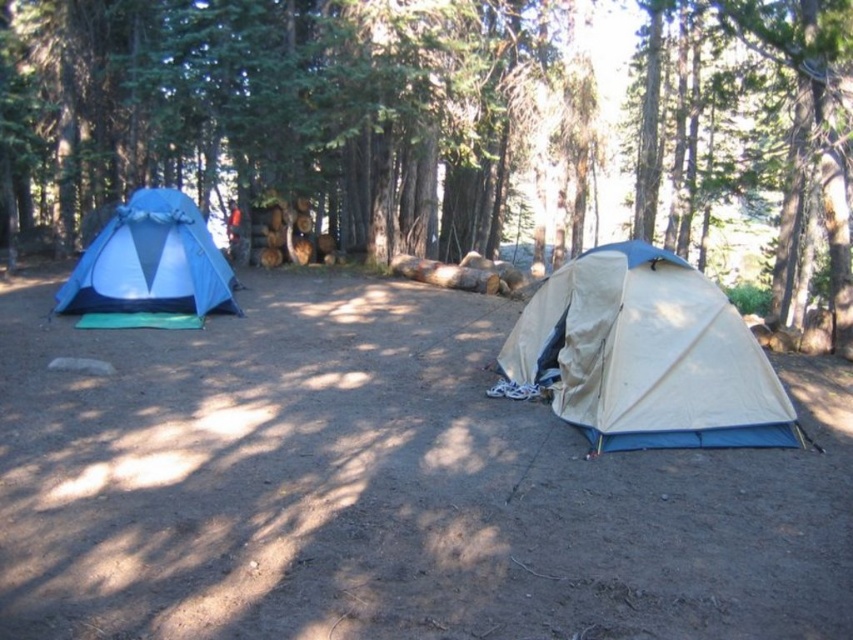
You are a hiker who wants to set up a new tent in this camping area. You have a map showing a specific coordinate point. Which tent is located at the coordinate point (303, 120)?

The point at coordinate (303, 120) indicates the green matte tent at left.

You are standing at the center of the image and want to find the green matte tent at left. Based on its 2D coordinates, in which direction should you look to locate it?

The green matte tent at left is located at coordinates point (x=303, y=120), so you should look to the left side of the image to find it.

You are a camper who wants to set up a new tent between the green matte tent at left and the matte blue tent at left. Can you fit your tent there if your tent is 1.5 meters wide?

The green matte tent at left is positioned on the right side of the matte blue tent at left, so there is space between them. However, the distance between the two tents isn not specified in the provided information. Without knowing the exact spacing, it is impossible to determine if your 1.5 meter wide tent will fit.